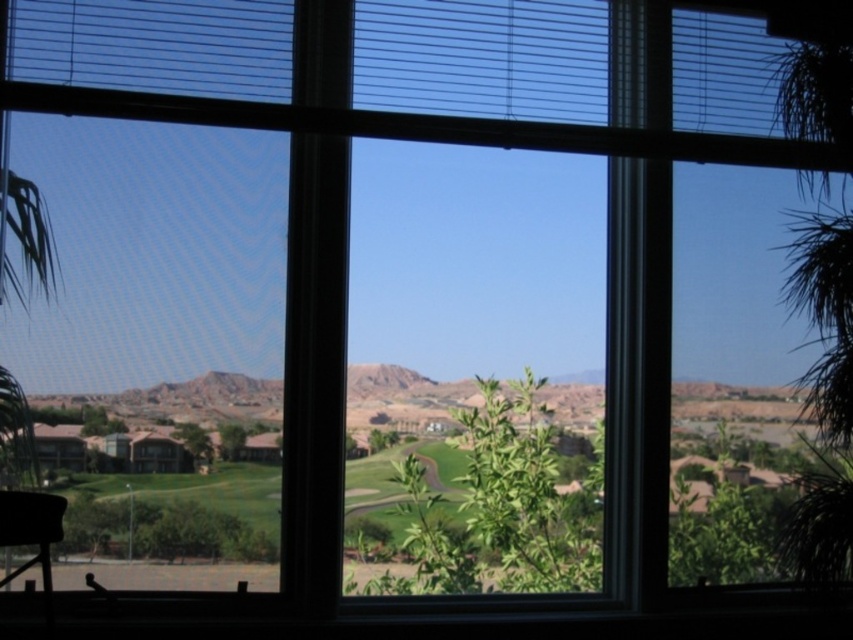
Is desert sandstone mountain at center above matte black chair at lower left?

Correct, desert sandstone mountain at center is located above matte black chair at lower left.

Is point (469, 385) positioned before point (44, 538)?

No, it is not.

The width and height of the screenshot is (853, 640). In order to click on desert sandstone mountain at center in this screenshot , I will do `click(187, 397)`.